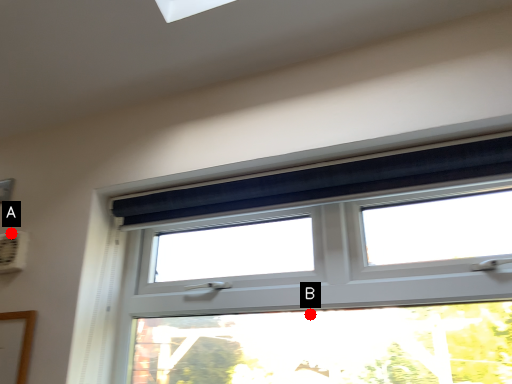
Question: Two points are circled on the image, labeled by A and B beside each circle. Among these points, which one is nearest to the camera?

Choices:
 (A) A is closer
 (B) B is closer

Answer: (B)